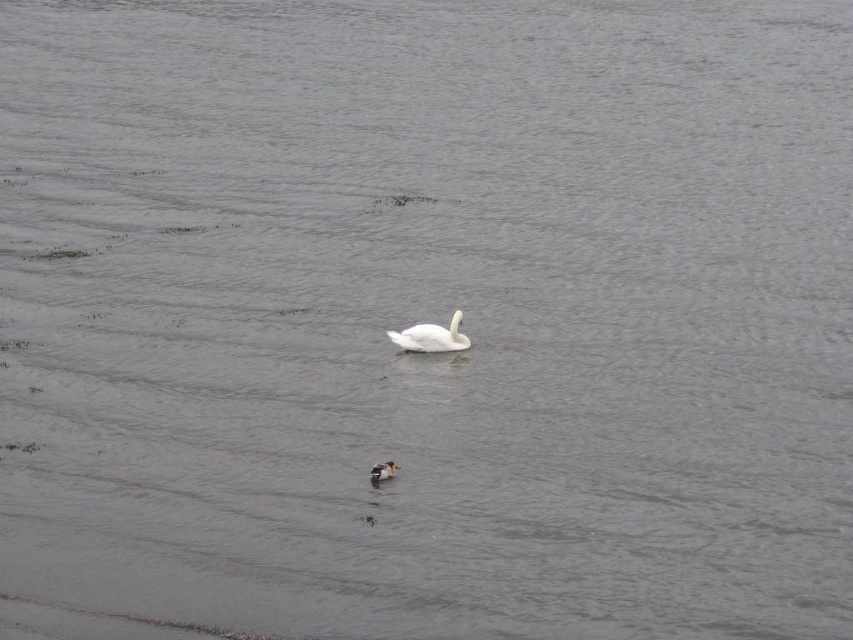
Is white smooth swan at center closer to camera compared to brown speckled duck at center?

No, white smooth swan at center is behind brown speckled duck at center.

Between point (454, 337) and point (393, 476), which one is positioned behind?

The point (454, 337) is behind.

Measure the distance between point [415,332] and camera.

A distance of 35.54 feet exists between point [415,332] and camera.

You are a GUI agent. You are given a task and a screenshot of the screen. Output one action in this format:
    pyautogui.click(x=<x>, y=<y>)
    Task: Click on the white smooth swan at center
    This screenshot has height=640, width=853.
    Given the screenshot: What is the action you would take?
    pyautogui.click(x=431, y=337)